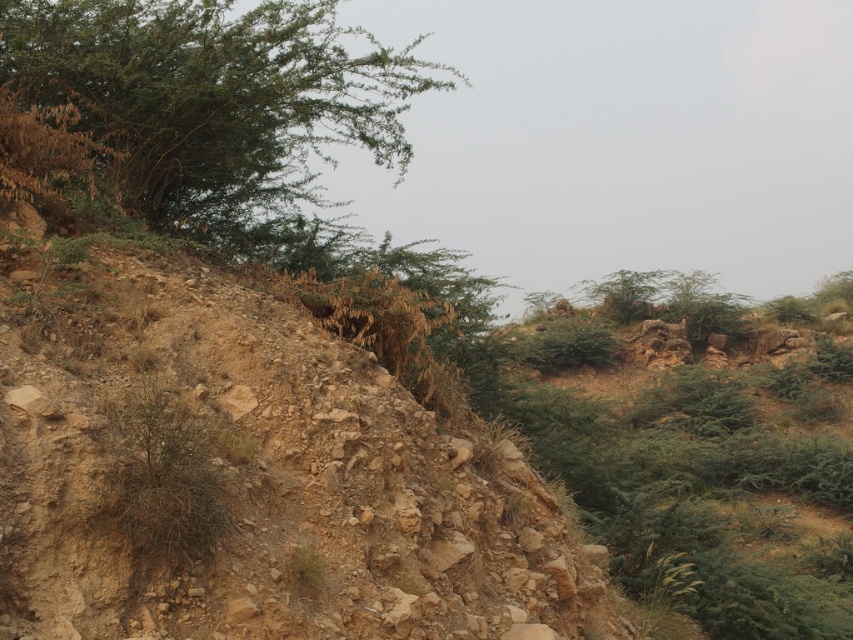
In the scene shown: Which of these two, green leafy shrubs at upper center or green leafy shrub at upper left, stands taller?

green leafy shrub at upper left

This screenshot has height=640, width=853. Identify the location of green leafy shrubs at upper center. (686, 456).

Is dull brown dirt at center closer to the viewer compared to green leafy shrub at upper left?

That is True.

Between point (335, 406) and point (289, 67), which one is positioned in front?

Point (335, 406) is more forward.

The width and height of the screenshot is (853, 640). Find the location of `dull brown dirt at center`. dull brown dirt at center is located at coordinates (248, 474).

Image resolution: width=853 pixels, height=640 pixels. In order to click on dull brown dirt at center in this screenshot , I will do `click(248, 474)`.

This screenshot has width=853, height=640. Describe the element at coordinates (248, 474) in the screenshot. I see `dull brown dirt at center` at that location.

How far apart are dull brown dirt at center and green leafy shrubs at upper center?

dull brown dirt at center is 8.79 meters away from green leafy shrubs at upper center.

What are the coordinates of `dull brown dirt at center` in the screenshot? It's located at (248, 474).

Identify the location of dull brown dirt at center. This screenshot has width=853, height=640. (248, 474).